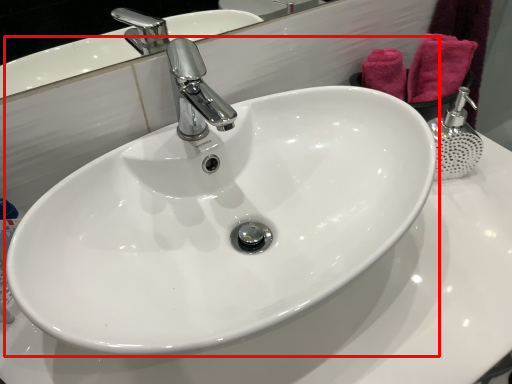
Question: From the image's perspective, considering the relative positions of sink (annotated by the red box) and bath towel in the image provided, where is sink (annotated by the red box) located with respect to the staircase?

Choices:
 (A) above
 (B) below

Answer: (B)